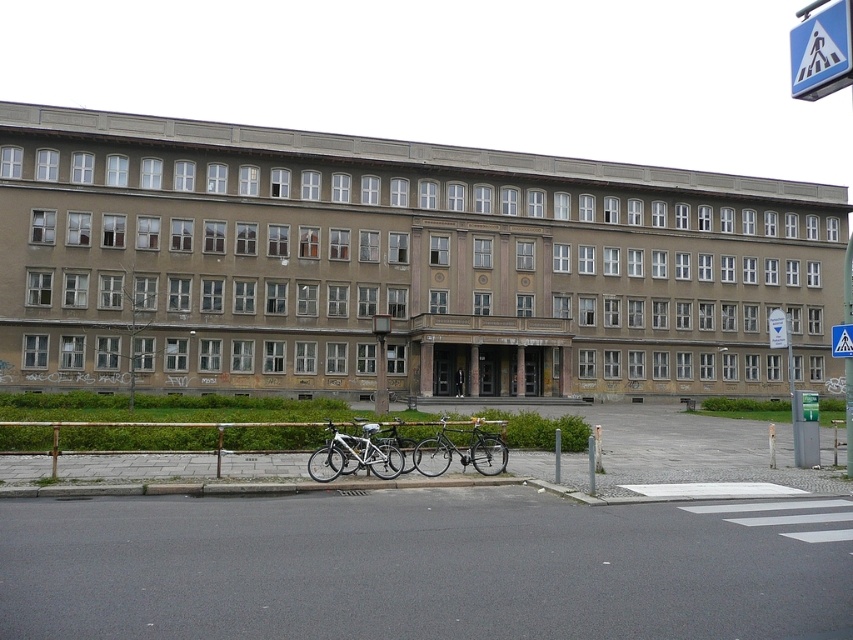
You are standing in front of the building and want to retrieve your black leather jacket at center. However, there are bicycles blocking your path. Can you walk around the white matte bicycle at lower center to reach your jacket?

The white matte bicycle at lower center is located above the black leather jacket at center, which means the jacket is positioned lower than the bicycle. Since the jacket is lower, you can walk around the bicycle to reach it.

You are standing at the entrance of the building and want to locate the white matte bicycle at lower center. Based on the coordinates provided, can you estimate its position relative to the entrance?

The white matte bicycle at lower center is located at coordinates (354,456). Since the entrance is at the front of the building, the bicycle is positioned to the right and slightly forward from the entrance.

You are a delivery person who needs to load a shiny silver bicycle at center and a black leather jacket at center into a van. The van has a height restriction of 1.2 meters. Which item might not fit if placed vertically?

The black leather jacket at center might not fit because the shiny silver bicycle at center has a lesser height compared to black leather jacket at center, implying the jacket is taller than the bicycle. Since the bicycle is shorter, the jacket could exceed the van height limit.